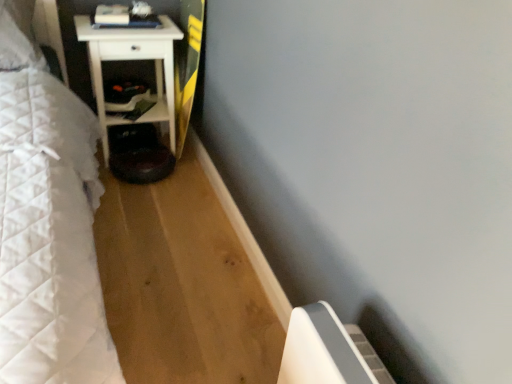
Question: Based on their sizes in the image, would you say white matte nightstand at left is bigger or smaller than shiny black step stool at lower center?

Choices:
 (A) small
 (B) big

Answer: (B)

Question: Is white matte nightstand at left to the left or to the right of shiny black step stool at lower center in the image?

Choices:
 (A) right
 (B) left

Answer: (B)

Question: Estimate the real-world distances between objects in this image. Which object is closer to the shiny black step stool at lower center?

Choices:
 (A) matte black shelf at lower left
 (B) yellow-green wood longboard at center
 (C) white matte nightstand at left

Answer: (A)

Question: Estimate the real-world distances between objects in this image. Which object is closer to the white matte nightstand at left?

Choices:
 (A) shiny black step stool at lower center
 (B) matte black shelf at lower left
 (C) yellow-green wood longboard at center

Answer: (B)